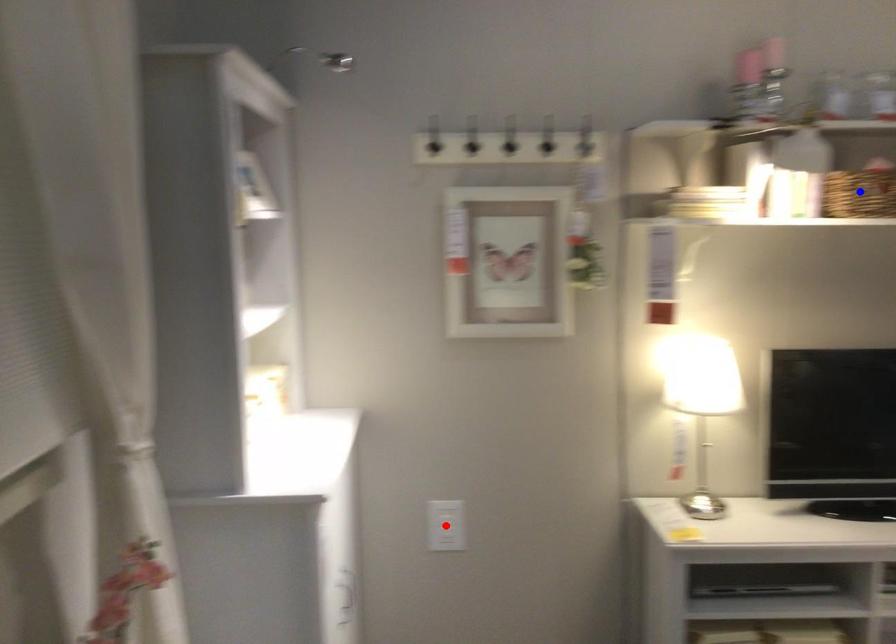
Question: In the image, two points are highlighted. Which point is nearer to the camera? Reply with the corresponding letter.

Choices:
 (A) blue point
 (B) red point

Answer: (A)